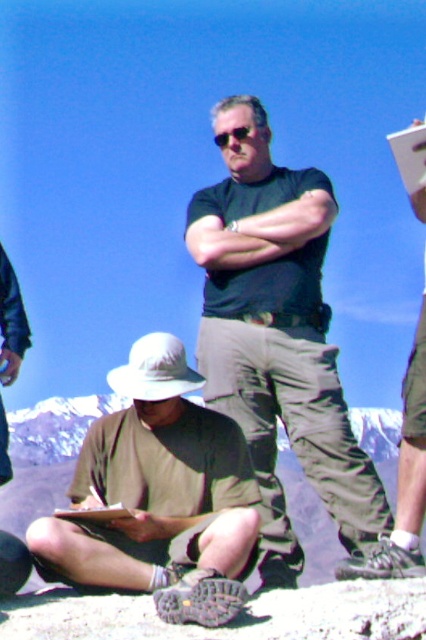
You are a photographer trying to capture both the matte black shirt at center and the white paper at upper right in a single frame. Given their positions, which object should you focus on first to ensure both are in the frame?

The matte black shirt at center is taller than the white paper at upper right, so you should focus on the matte black shirt at center first to ensure both are in the frame.

In the scene shown: You are a photographer trying to capture a clear shot of the white paper at upper right and the reflective plastic sunglasses at center. Since the scene is under bright sunlight, you need to adjust your camera settings to avoid glare. Which object might require more attention to reduce glare, and why?

The reflective plastic sunglasses at center might require more attention to reduce glare because they are made of reflective material, which can cause more intense reflections under bright sunlight compared to the white paper at upper right.